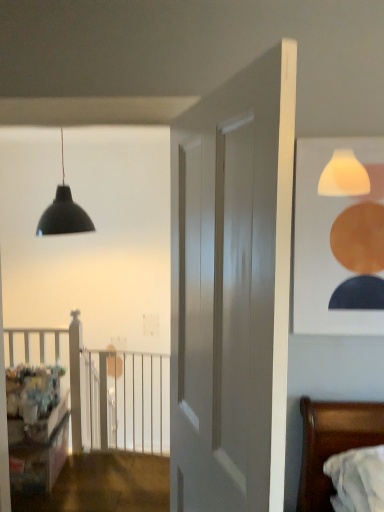
Question: From a real-world perspective, is wooden bed at lower right beneath matte white picture frame at upper right?

Choices:
 (A) no
 (B) yes

Answer: (B)

Question: Is wooden bed at lower right further to the viewer compared to matte white picture frame at upper right?

Choices:
 (A) yes
 (B) no

Answer: (B)

Question: Does wooden bed at lower right turn towards matte white picture frame at upper right?

Choices:
 (A) no
 (B) yes

Answer: (A)

Question: Is wooden bed at lower right shorter than matte white picture frame at upper right?

Choices:
 (A) no
 (B) yes

Answer: (B)

Question: Is the position of wooden bed at lower right less distant than that of matte white picture frame at upper right?

Choices:
 (A) no
 (B) yes

Answer: (B)

Question: Can you confirm if wooden bed at lower right is taller than matte white picture frame at upper right?

Choices:
 (A) yes
 (B) no

Answer: (B)

Question: Considering the relative sizes of wooden dresser at lower left and matte white picture frame at upper right in the image provided, is wooden dresser at lower left wider than matte white picture frame at upper right?

Choices:
 (A) no
 (B) yes

Answer: (B)

Question: Is wooden dresser at lower left located outside matte white picture frame at upper right?

Choices:
 (A) no
 (B) yes

Answer: (B)

Question: From a real-world perspective, is wooden dresser at lower left on top of matte white picture frame at upper right?

Choices:
 (A) yes
 (B) no

Answer: (B)

Question: Is wooden dresser at lower left to the left of matte white picture frame at upper right from the viewer's perspective?

Choices:
 (A) no
 (B) yes

Answer: (B)

Question: Can you confirm if wooden dresser at lower left is smaller than matte white picture frame at upper right?

Choices:
 (A) no
 (B) yes

Answer: (A)

Question: Can you confirm if wooden dresser at lower left is thinner than matte white picture frame at upper right?

Choices:
 (A) no
 (B) yes

Answer: (A)

Question: From the image's perspective, is wooden dresser at lower left above matte black pendant light at upper left?

Choices:
 (A) yes
 (B) no

Answer: (B)